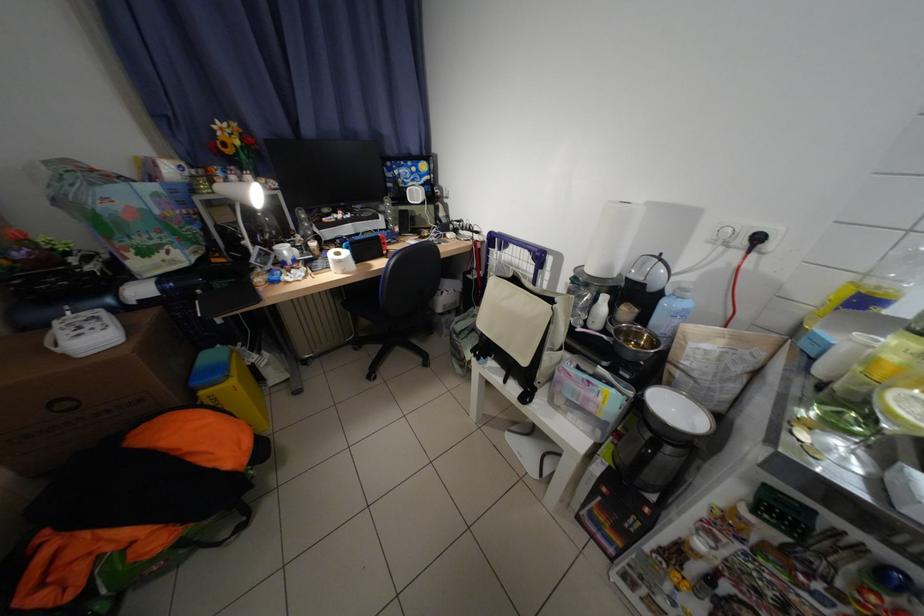
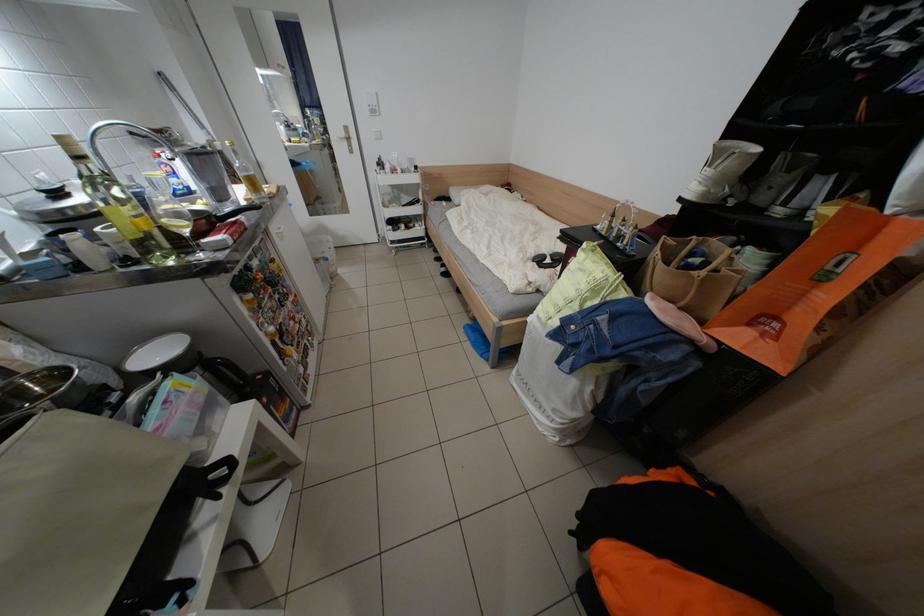
The point at (541, 403) is marked in the first image. Where is the corresponding point in the second image?

(238, 463)